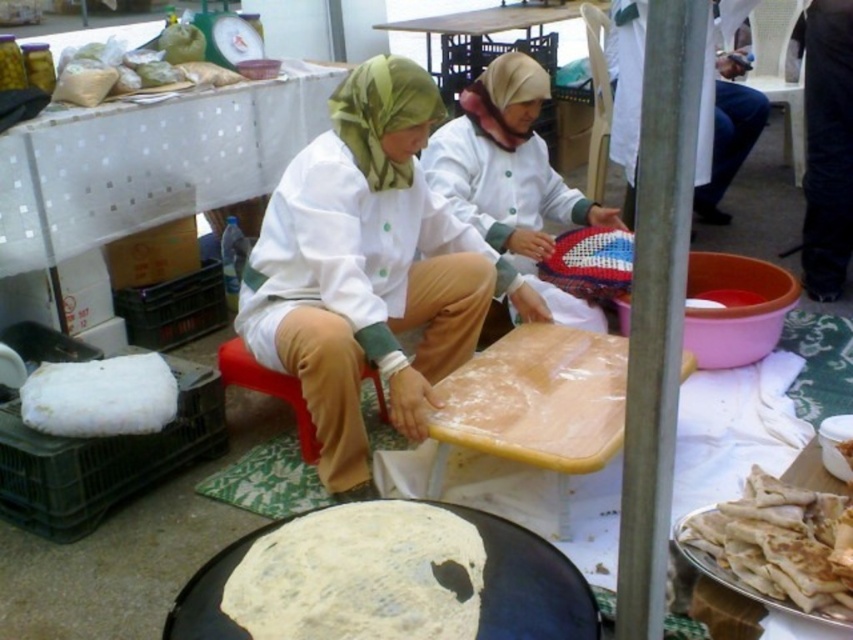
Question: Can you confirm if matte white shirt at center is positioned to the left of green silk headscarf at upper center?

Choices:
 (A) no
 (B) yes

Answer: (A)

Question: Is golden crispy flatbread at lower right to the left of green silk headscarf at upper center from the viewer's perspective?

Choices:
 (A) no
 (B) yes

Answer: (A)

Question: Among these points, which one is farthest from the camera?

Choices:
 (A) (769, 516)
 (B) (515, 128)
 (C) (88, 364)

Answer: (B)

Question: Which of the following is the farthest from the observer?

Choices:
 (A) (693, 518)
 (B) (10, 292)
 (C) (318, 260)
 (D) (491, 90)

Answer: (D)

Question: Does white plastic table at upper left have a lesser width compared to green silk headscarf at upper center?

Choices:
 (A) yes
 (B) no

Answer: (B)

Question: Which object appears farthest from the camera in this image?

Choices:
 (A) white plastic table at upper left
 (B) white matte fabric at center
 (C) red plastic stool at lower center
 (D) golden crispy flatbread at lower right

Answer: (B)